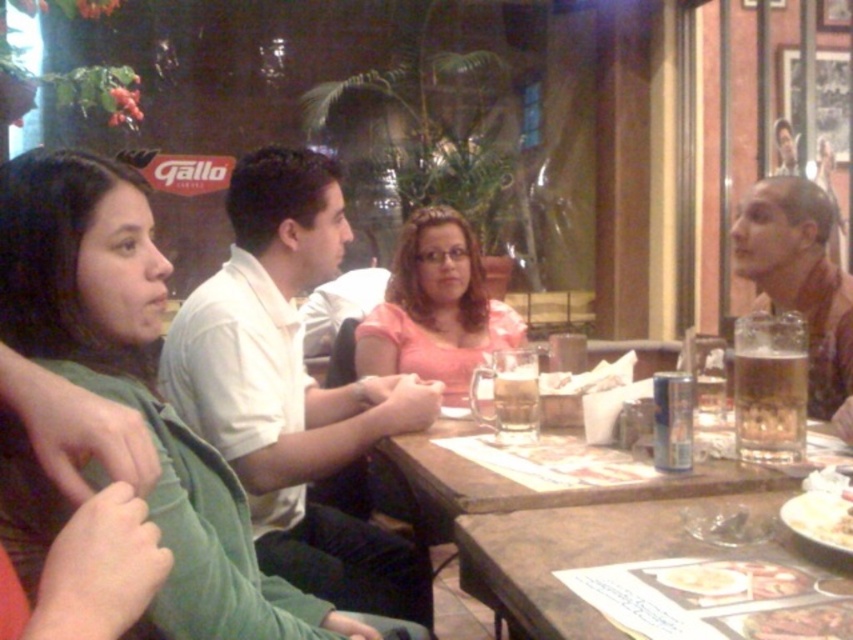
Looking at this image, please look at the point marked at coordinate (292, 388). What object is located at that point?

The white cotton shirt at center is located at the point marked at coordinate (292, 388).

You are a server at the restaurant and need to place a new drink order on the table. The brown wooden table at center is currently cluttered with items. Where should you place the new drink to avoid blocking the translucent glass mug at table center?

The brown wooden table at center is located below the translucent glass mug at table center, so placing the new drink on the table surface away from the mug would prevent blocking it.

You are a waiter in a restaurant and need to place a new order at the brown leather table at center. However, there is a pink fabric shirt at center in the way. Can you still reach the table without disturbing the shirt?

The brown leather table at center is positioned under the pink fabric shirt at center, so the shirt is likely draped over the table. This means you can still reach the table by carefully moving the shirt aside or placing the order underneath without disturbing it.